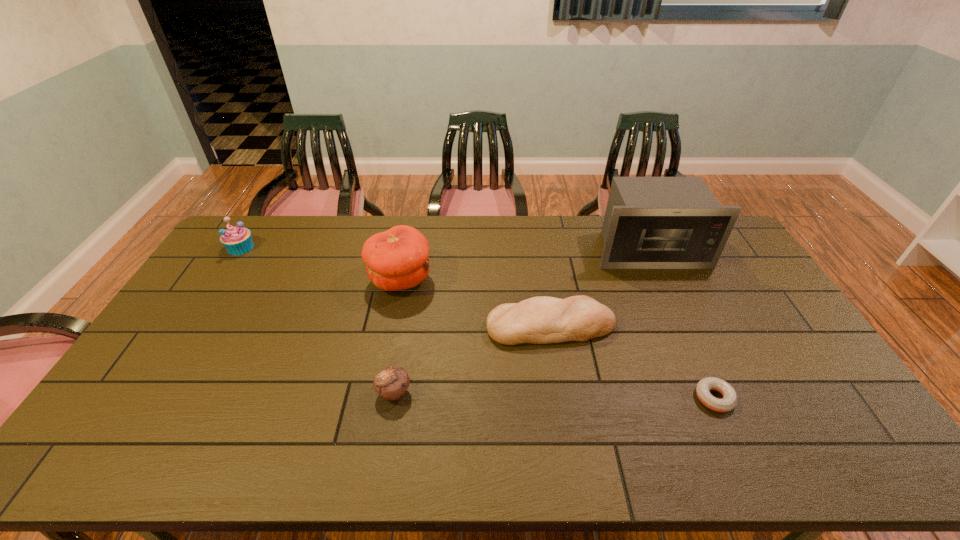
Identify the location of vacant space in between the farther muffin and the tallest object. (444, 249).

At what (x,y) coordinates should I click in order to perform the action: click on empty space that is in between the third nearest object and the microwave oven. Please return your answer as a coordinate pair (x, y). Image resolution: width=960 pixels, height=540 pixels. Looking at the image, I should click on (600, 288).

Locate an element on the screen. The width and height of the screenshot is (960, 540). unoccupied position between the doughnut and the third nearest object is located at coordinates (633, 362).

Identify the location of vacant space that's between the doughnut and the fourth object from left to right. (633, 362).

Locate an element on the screen. This screenshot has height=540, width=960. the third closest object to the right muffin is located at coordinates (703, 387).

What are the coordinates of `object that ranks as the second closest to the third nearest object` in the screenshot? It's located at (396, 259).